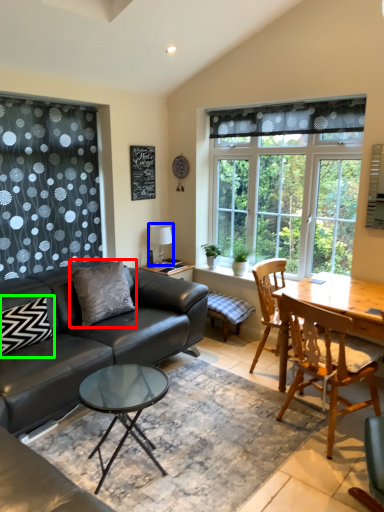
Question: Which object is positioned farthest from pillow (highlighted by a red box)? Select from lamp (highlighted by a blue box) and pillow (highlighted by a green box).

Choices:
 (A) lamp
 (B) pillow

Answer: (A)